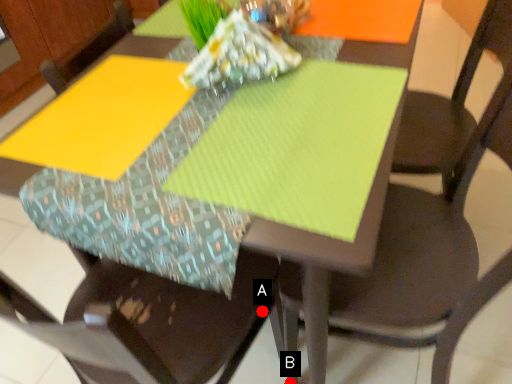
Question: Two points are circled on the image, labeled by A and B beside each circle. Which point is farther from the camera taking this photo?

Choices:
 (A) A is further
 (B) B is further

Answer: (B)